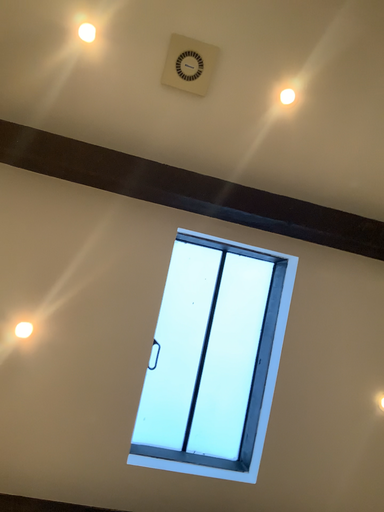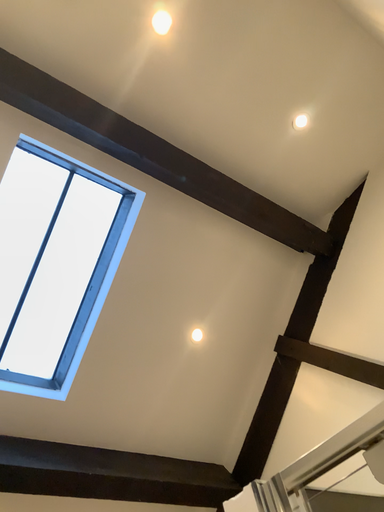
Question: Which way did the camera rotate in the video?

Choices:
 (A) rotated upward
 (B) rotated downward

Answer: (B)